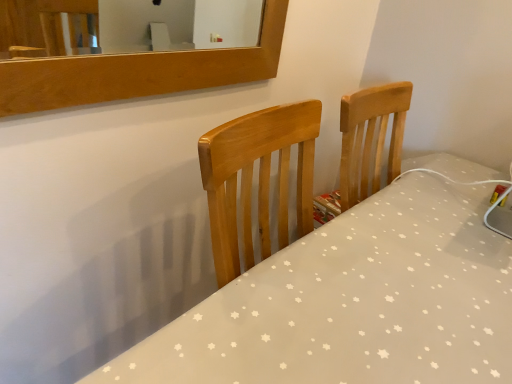
Describe the element at coordinates (354, 303) in the screenshot. This screenshot has height=384, width=512. I see `wooden chair at center` at that location.

The width and height of the screenshot is (512, 384). Identify the location of wooden chair at center. tap(354, 303).

Measure the distance between wooden chair at center and camera.

A distance of 22.78 inches exists between wooden chair at center and camera.

Where is `wooden chair at center`? Image resolution: width=512 pixels, height=384 pixels. wooden chair at center is located at coordinates (354, 303).